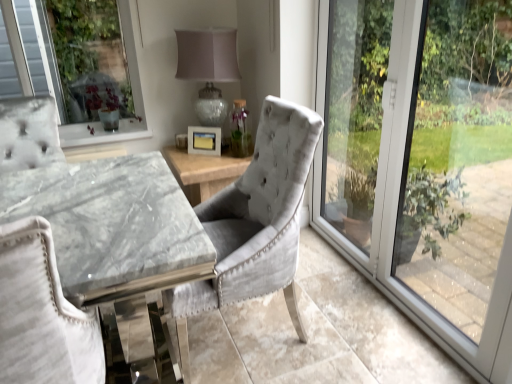
The height and width of the screenshot is (384, 512). In order to click on free region under velvet grey chair at center, placed as the 2th chair when sorted from left to right (from a real-world perspective) in this screenshot , I will do `click(242, 327)`.